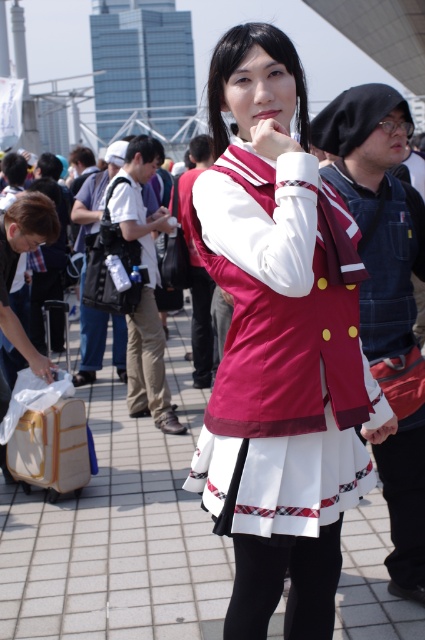
You are a photographer trying to capture a photo of the person in the white fabric skirt at center without including the wooden suitcase at lower left in the frame. Given that your camera has a focal length of 50mm and you are currently 3 meters away from the skirt, is it possible to adjust your position to exclude the suitcase?

The white fabric skirt at center and wooden suitcase at lower left are 2.41 meters apart. Since the distance between them is less than the photographer is away from the subject, it might be challenging to exclude the suitcase without moving closer or changing the angle. However, by moving slightly to the side or adjusting the camera angle, the photographer could potentially frame the shot to exclude the wooden suitcase at lower left while keeping the white fabric skirt at center in view.

You are a photographer at the event and want to capture a photo of the person in the center without any obstructions. Since the wooden suitcase at lower left is in the way, can you move the suitcase to the side to get a clear shot of the white fabric skirt at center? Explain your reasoning based on their sizes.

The white fabric skirt at center is narrower than the wooden suitcase at lower left. Moving the suitcase to the side would free up enough space to capture the skirt without obstruction since the suitcase is wider and can be shifted out of the frame more easily.